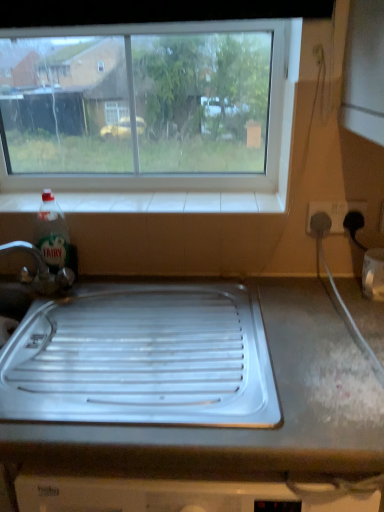
Question: Relative to metallic gray tray at center, is green translucent liquid at bottle left in front or behind?

Choices:
 (A) front
 (B) behind

Answer: (B)

Question: Would you say green translucent liquid at bottle left is inside or outside metallic gray tray at center?

Choices:
 (A) outside
 (B) inside

Answer: (A)

Question: Considering the real-world distances, which object is closest to the white plastic socket at right?

Choices:
 (A) transparent glass window at upper center
 (B) white tile at upper center
 (C) metallic gray tray at center
 (D) green translucent liquid at bottle left

Answer: (A)

Question: Which of these objects is positioned farthest from the green translucent liquid at bottle left?

Choices:
 (A) transparent glass window at upper center
 (B) white tile at upper center
 (C) metallic gray tray at center
 (D) white plastic socket at right

Answer: (D)